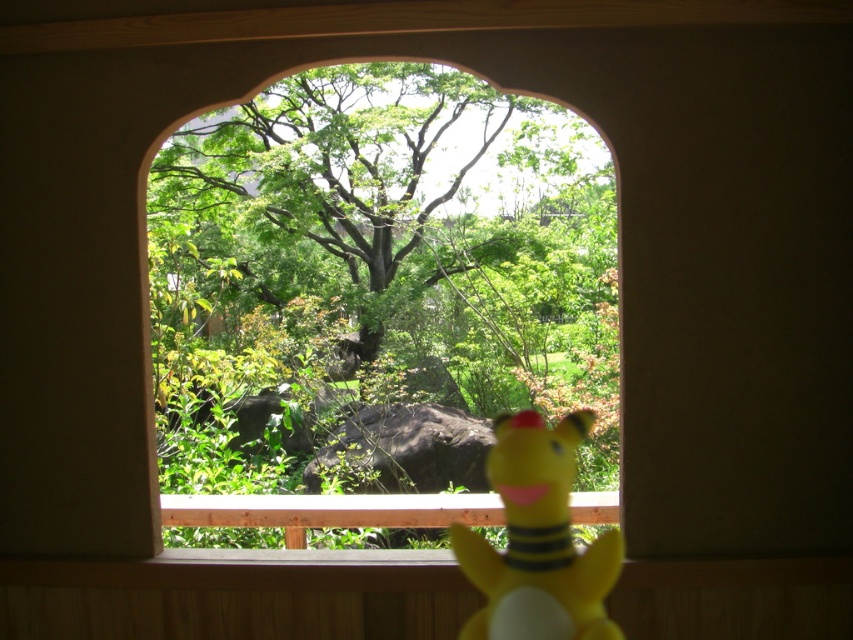
Does point (596, 376) come closer to viewer compared to point (566, 480)?

No.

Which of these two, green matte window at center or yellow rubber duck at lower right, stands shorter?

green matte window at center is shorter.

Which is in front, point (379, 234) or point (521, 417)?

Positioned in front is point (521, 417).

What are the coordinates of `green matte window at center` in the screenshot? It's located at (376, 280).